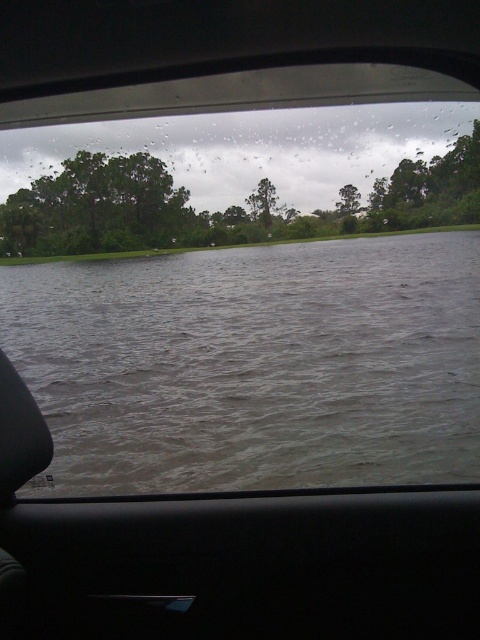
Is gray water at center positioned behind green leafy tree at upper center?

That is False.

The width and height of the screenshot is (480, 640). In order to click on gray water at center in this screenshot , I will do `click(253, 364)`.

Consider the image. Is gray water at center taller than green leafy tree at center?

Correct, gray water at center is much taller as green leafy tree at center.

Describe the element at coordinates (253, 364) in the screenshot. I see `gray water at center` at that location.

I want to click on gray water at center, so click(x=253, y=364).

Locate an element on the screen. gray water at center is located at coordinates (253, 364).

Is green leafy tree at upper center taller than green leafy tree at center?

Yes.

Is point (288, 212) behind point (349, 214)?

No, (288, 212) is in front of (349, 214).

Identify the location of green leafy tree at upper center. This screenshot has width=480, height=640. (225, 186).